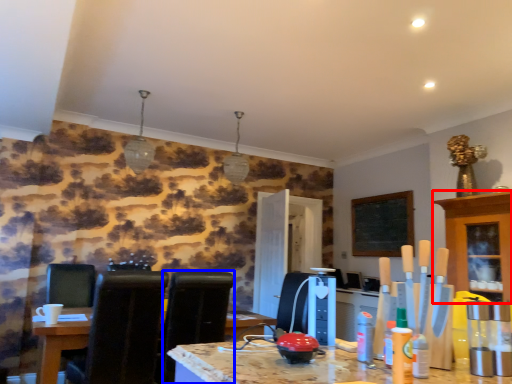
Question: Which object is closer to the camera taking this photo, cabinetry (highlighted by a red box) or chair (highlighted by a blue box)?

Choices:
 (A) cabinetry
 (B) chair

Answer: (B)